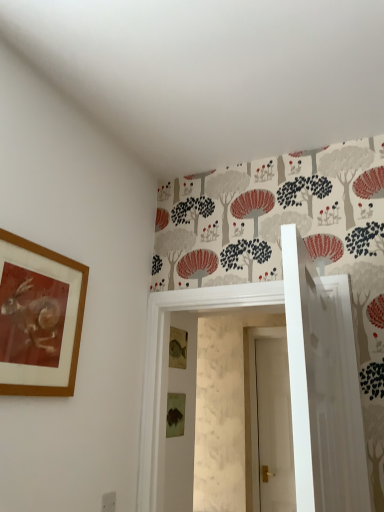
The width and height of the screenshot is (384, 512). In order to click on wooden framed print at upper left in this screenshot , I will do `click(39, 318)`.

Describe the element at coordinates (39, 318) in the screenshot. The width and height of the screenshot is (384, 512). I see `wooden framed print at upper left` at that location.

Locate an element on the screen. The width and height of the screenshot is (384, 512). wooden framed print at upper left is located at coordinates (39, 318).